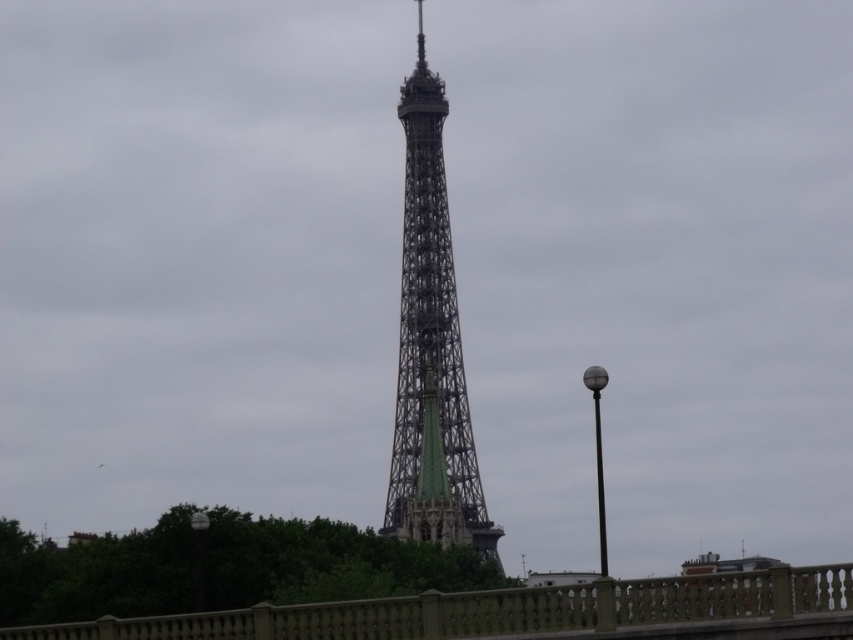
Question: Which of the following is the closest to the observer?

Choices:
 (A) (432, 506)
 (B) (318, 637)

Answer: (B)

Question: Is beige stone fence at lower center smaller than metallic lattice tower at center?

Choices:
 (A) yes
 (B) no

Answer: (A)

Question: Which point appears closest to the camera in this image?

Choices:
 (A) (563, 588)
 (B) (418, 348)

Answer: (A)

Question: Is beige stone fence at lower center closer to camera compared to metallic lattice tower at center?

Choices:
 (A) no
 (B) yes

Answer: (B)

Question: Is beige stone fence at lower center positioned at the back of metallic lattice tower at center?

Choices:
 (A) no
 (B) yes

Answer: (A)